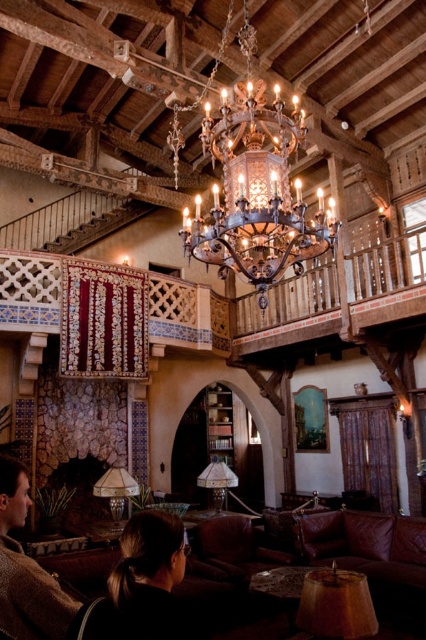
Between dark brown leather hair at center and brown wool sweater at lower left, which one appears on the left side from the viewer's perspective?

From the viewer's perspective, brown wool sweater at lower left appears more on the left side.

Between dark brown leather hair at center and brown wool sweater at lower left, which one has more height?

brown wool sweater at lower left is taller.

What do you see at coordinates (143, 586) in the screenshot?
I see `dark brown leather hair at center` at bounding box center [143, 586].

Locate an element on the screen. This screenshot has height=640, width=426. dark brown leather hair at center is located at coordinates (143, 586).

Is point (258, 246) closer to viewer compared to point (40, 628)?

No, (258, 246) is behind (40, 628).

Consider the image. Between antique brass chandelier at center and brown wool sweater at lower left, which one is positioned lower?

Positioned lower is brown wool sweater at lower left.

Between point (284, 124) and point (11, 481), which one is positioned in front?

Point (11, 481) is in front.

Locate an element on the screen. The height and width of the screenshot is (640, 426). antique brass chandelier at center is located at coordinates (256, 186).

Consider the image. Who is higher up, antique brass chandelier at center or dark brown leather hair at center?

Positioned higher is antique brass chandelier at center.

Is antique brass chandelier at center below dark brown leather hair at center?

Incorrect, antique brass chandelier at center is not positioned below dark brown leather hair at center.

Is point (288, 212) farther from viewer compared to point (143, 522)?

That is True.

Locate an element on the screen. The width and height of the screenshot is (426, 640). antique brass chandelier at center is located at coordinates (256, 186).